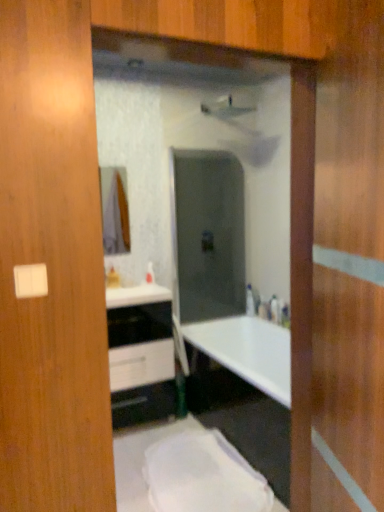
Identify the location of satin nickel faucet at center. This screenshot has height=512, width=384. (252, 301).

The image size is (384, 512). What do you see at coordinates (252, 301) in the screenshot? I see `satin nickel faucet at center` at bounding box center [252, 301].

The image size is (384, 512). What do you see at coordinates (140, 355) in the screenshot? I see `white glossy cabinet at center` at bounding box center [140, 355].

The width and height of the screenshot is (384, 512). I want to click on white glossy cabinet at center, so click(140, 355).

Identify the location of satin nickel faucet at center. point(252,301).

Considering the positions of objects white glossy cabinet at center and satin nickel faucet at center in the image provided, who is more to the left, white glossy cabinet at center or satin nickel faucet at center?

white glossy cabinet at center is more to the left.

Does white glossy cabinet at center lie behind satin nickel faucet at center?

No, it is in front of satin nickel faucet at center.

Considering the points (150, 325) and (249, 311), which point is in front, point (150, 325) or point (249, 311)?

Point (150, 325)

From the image's perspective, who appears lower, white glossy cabinet at center or satin nickel faucet at center?

white glossy cabinet at center is shown below in the image.

From a real-world perspective, relative to satin nickel faucet at center, is white glossy cabinet at center vertically above or below?

white glossy cabinet at center is situated lower than satin nickel faucet at center in the real world.

Considering the relative sizes of white glossy cabinet at center and satin nickel faucet at center in the image provided, is white glossy cabinet at center thinner than satin nickel faucet at center?

No.

In the scene shown: Can you confirm if white glossy cabinet at center is shorter than satin nickel faucet at center?

In fact, white glossy cabinet at center may be taller than satin nickel faucet at center.

Which of these two, white glossy cabinet at center or satin nickel faucet at center, is smaller?

Smaller between the two is satin nickel faucet at center.

Which is correct: white glossy cabinet at center is inside satin nickel faucet at center, or outside of it?

white glossy cabinet at center cannot be found inside satin nickel faucet at center.

Consider the image. Is white glossy cabinet at center with satin nickel faucet at center?

white glossy cabinet at center is not next to satin nickel faucet at center, and they're not touching.

Is satin nickel faucet at center at the back of white glossy cabinet at center?

No.

In the scene shown: How distant is white glossy cabinet at center from satin nickel faucet at center?

They are 3.93 feet apart.

Image resolution: width=384 pixels, height=512 pixels. What are the coordinates of `bathroom cabinet directly beneath the satin nickel faucet at center (from a real-world perspective)` in the screenshot? It's located at (140, 355).

Is satin nickel faucet at center at the right side of white glossy cabinet at center?

Correct, you'll find satin nickel faucet at center to the right of white glossy cabinet at center.

Is satin nickel faucet at center closer to camera compared to white glossy cabinet at center?

No, the depth of satin nickel faucet at center is greater than that of white glossy cabinet at center.

Is point (255, 307) closer to camera compared to point (141, 409)?

No, it is not.

From the image's perspective, is satin nickel faucet at center located above white glossy cabinet at center?

Indeed, from the image's perspective, satin nickel faucet at center is shown above white glossy cabinet at center.

From a real-world perspective, is satin nickel faucet at center physically below white glossy cabinet at center?

Actually, satin nickel faucet at center is physically above white glossy cabinet at center in the real world.

Considering the sizes of objects satin nickel faucet at center and white glossy cabinet at center in the image provided, who is thinner, satin nickel faucet at center or white glossy cabinet at center?

satin nickel faucet at center.

Can you confirm if satin nickel faucet at center is taller than white glossy cabinet at center?

No, satin nickel faucet at center is not taller than white glossy cabinet at center.

Considering the relative sizes of satin nickel faucet at center and white glossy cabinet at center in the image provided, is satin nickel faucet at center smaller than white glossy cabinet at center?

Yes, satin nickel faucet at center is smaller than white glossy cabinet at center.

Do you think satin nickel faucet at center is within white glossy cabinet at center, or outside of it?

The correct answer is: outside.

Is satin nickel faucet at center positioned far away from white glossy cabinet at center?

Yes, satin nickel faucet at center and white glossy cabinet at center are located far from each other.

Does satin nickel faucet at center turn towards white glossy cabinet at center?

No, satin nickel faucet at center is not facing towards white glossy cabinet at center.

Can you tell me how much satin nickel faucet at center and white glossy cabinet at center differ in facing direction?

The angle between the facing direction of satin nickel faucet at center and the facing direction of white glossy cabinet at center is 180 degrees.

Measure the distance between satin nickel faucet at center and white glossy cabinet at center.

3.93 feet.

What are the coordinates of `bathroom cabinet below the satin nickel faucet at center (from the image's perspective)` in the screenshot? It's located at (140, 355).

The image size is (384, 512). What are the coordinates of `bathroom cabinet below the satin nickel faucet at center (from a real-world perspective)` in the screenshot? It's located at (140, 355).

Find the location of `faucet that appears on the right of white glossy cabinet at center`. faucet that appears on the right of white glossy cabinet at center is located at coordinates (252, 301).